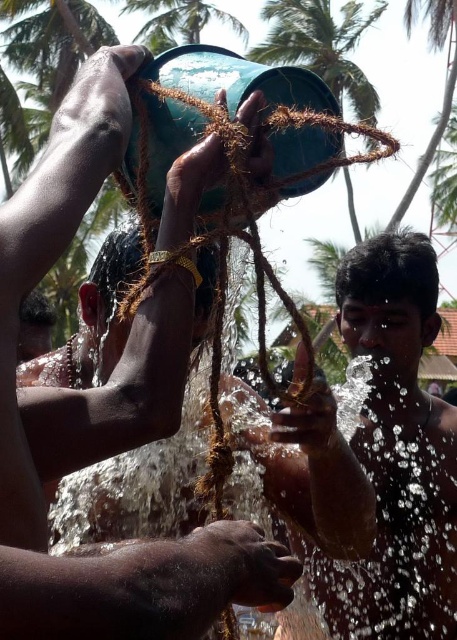
Can you confirm if glossy brown hair at center is positioned below green leafy palm tree at upper center?

Correct, glossy brown hair at center is located below green leafy palm tree at upper center.

This screenshot has height=640, width=457. I want to click on glossy brown hair at center, so click(x=396, y=452).

Measure the distance between point (408, 480) and camera.

Point (408, 480) and camera are 8.84 feet apart.

Locate an element on the screen. This screenshot has width=457, height=640. glossy brown hair at center is located at coordinates (396, 452).

Between point (58, 408) and point (271, 4), which one is positioned behind?

The point (271, 4) is behind.

Who is lower down, matte green bucket at upper center or green matte palm tree at upper center?

matte green bucket at upper center is lower down.

Is point (38, 193) more distant than point (286, 28)?

That is False.

You are a GUI agent. You are given a task and a screenshot of the screen. Output one action in this format:
    pyautogui.click(x=<x>, y=<y>)
    Task: Click on the matte green bucket at upper center
    This screenshot has width=457, height=640.
    Given the screenshot: What is the action you would take?
    pyautogui.click(x=105, y=416)

Can you confirm if glossy brown hair at center is smaller than green matte palm tree at upper center?

Indeed, glossy brown hair at center has a smaller size compared to green matte palm tree at upper center.

Image resolution: width=457 pixels, height=640 pixels. Identify the location of glossy brown hair at center. (396, 452).